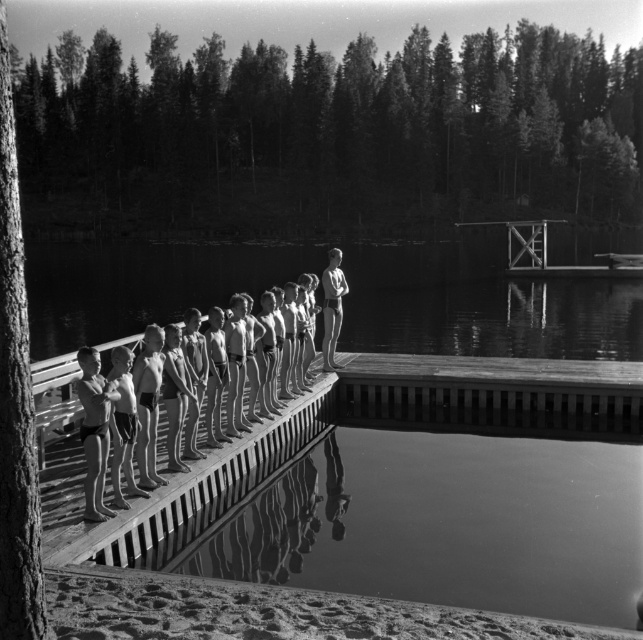
Question: Does smooth skin children at center have a lesser width compared to smooth skin boy at center?

Choices:
 (A) no
 (B) yes

Answer: (A)

Question: Can you confirm if smooth skin children at center is wider than smooth skin boy at center?

Choices:
 (A) yes
 (B) no

Answer: (A)

Question: Among these objects, which one is farthest from the camera?

Choices:
 (A) smooth skin children at center
 (B) smooth skin boy at center

Answer: (B)

Question: Which of the following is the farthest from the observer?

Choices:
 (A) smooth skin boy at center
 (B) smooth skin children at center

Answer: (A)

Question: Can you confirm if smooth skin children at center is smaller than smooth skin boy at center?

Choices:
 (A) no
 (B) yes

Answer: (A)

Question: Which object is closer to the camera taking this photo?

Choices:
 (A) smooth skin children at center
 (B) smooth skin boy at center

Answer: (A)